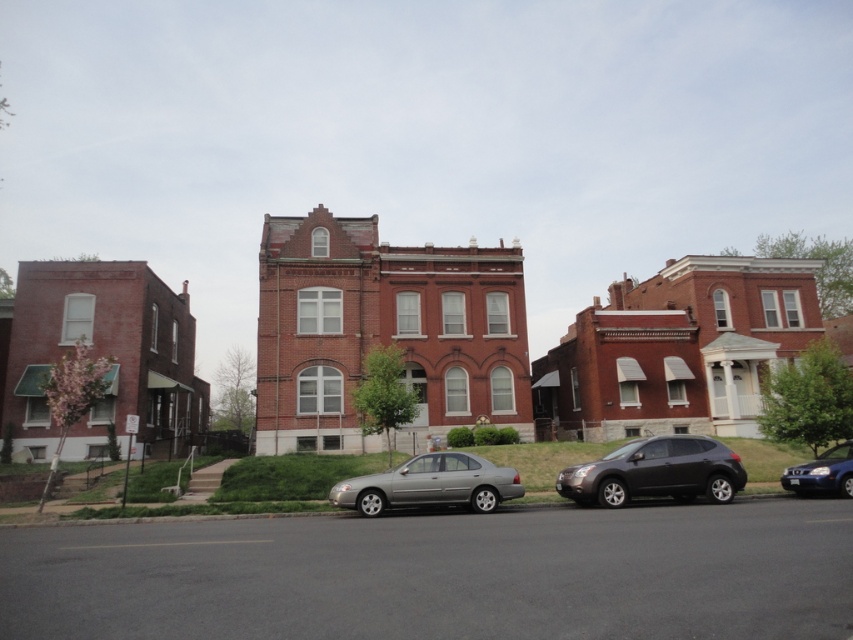
You are standing on the residential street and want to take a photo that includes both the point at coordinates point (440,484) and the point at coordinates point (787,481). Since the camera can only focus on objects at a certain distance, which point should you prioritize focusing on to ensure it appears sharp?

You should prioritize focusing on point (440,484) because it is closer to the camera than point (787,481), so it requires a different focal plane.

You are standing on the residential street and notice two points marked in the image. The first point is at coordinates point (717, 477) and the second point is at coordinates point (802, 467). Which point is closer to you?

Point (717, 477) is in front of point (802, 467), so the first point is closer to you.

You are a delivery driver who needs to park your vehicle between the two buildings at the center. Your vehicle is 1.8 meters tall. Can you safely park your vehicle between the satin black suv at center and the satin silver sedan at center?

The satin black suv at center is taller than the satin silver sedan at center. Since the tallest vehicle between them is the satin black suv at center at 1.8 meters, your vehicle can safely park between them as long as the parking space is wide enough.